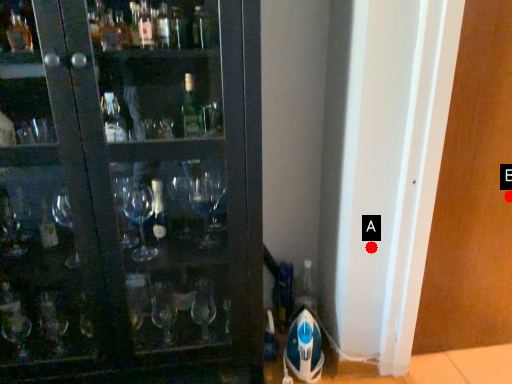
Question: Two points are circled on the image, labeled by A and B beside each circle. Which point is farther from the camera taking this photo?

Choices:
 (A) A is further
 (B) B is further

Answer: (B)